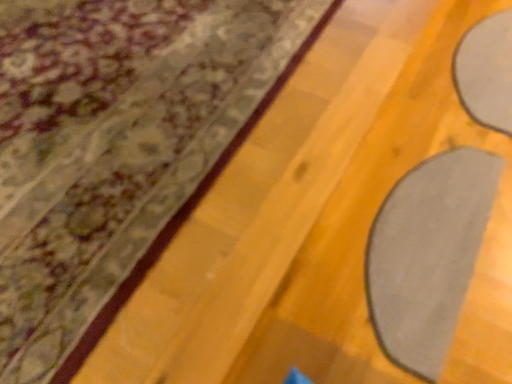
Question: Is gray matte yoga mat at lower right to the left or to the right of matte gray curtain at upper right in the image?

Choices:
 (A) right
 (B) left

Answer: (A)

Question: In terms of size, does gray matte yoga mat at lower right appear bigger or smaller than matte gray curtain at upper right?

Choices:
 (A) small
 (B) big

Answer: (A)

Question: From the image's perspective, is gray matte yoga mat at lower right above or below matte gray curtain at upper right?

Choices:
 (A) below
 (B) above

Answer: (A)

Question: Is matte gray curtain at upper right wider or thinner than gray matte yoga mat at lower right?

Choices:
 (A) wide
 (B) thin

Answer: (A)

Question: Considering the relative positions of matte gray curtain at upper right and gray matte yoga mat at lower right in the image provided, is matte gray curtain at upper right to the left or to the right of gray matte yoga mat at lower right?

Choices:
 (A) right
 (B) left

Answer: (B)

Question: From the image's perspective, is matte gray curtain at upper right positioned above or below gray matte yoga mat at lower right?

Choices:
 (A) below
 (B) above

Answer: (B)

Question: Considering their positions, is matte gray curtain at upper right located in front of or behind gray matte yoga mat at lower right?

Choices:
 (A) front
 (B) behind

Answer: (A)